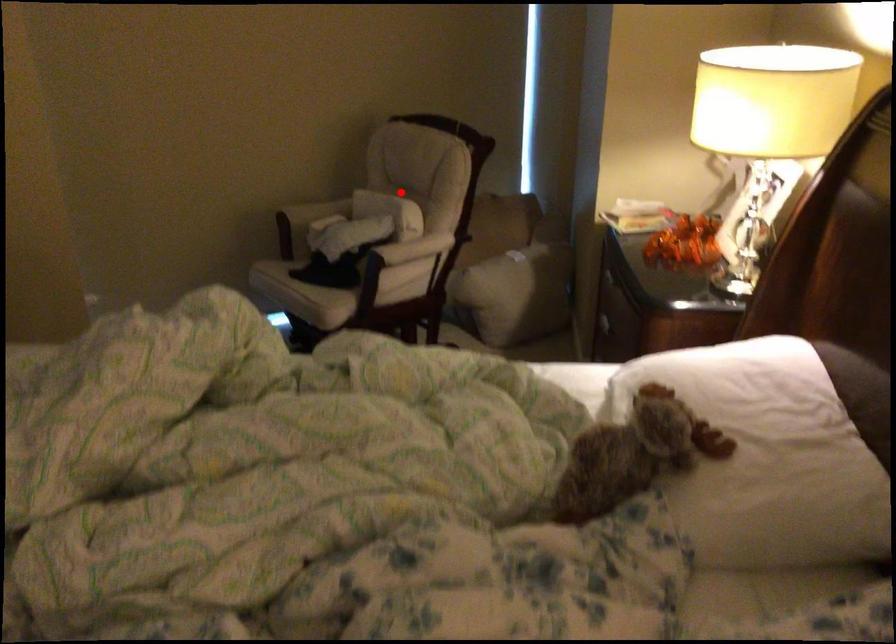
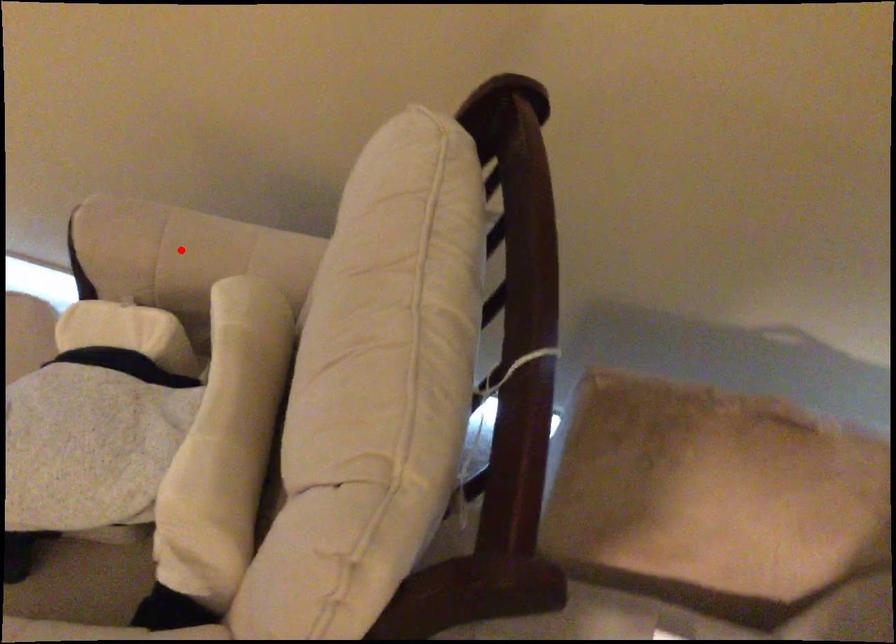
I am providing you with two images of the same scene from different viewpoints. A red point is marked on the first image and another point is marked on the second image. Do the highlighted points in image1 and image2 indicate the same real-world spot?

No